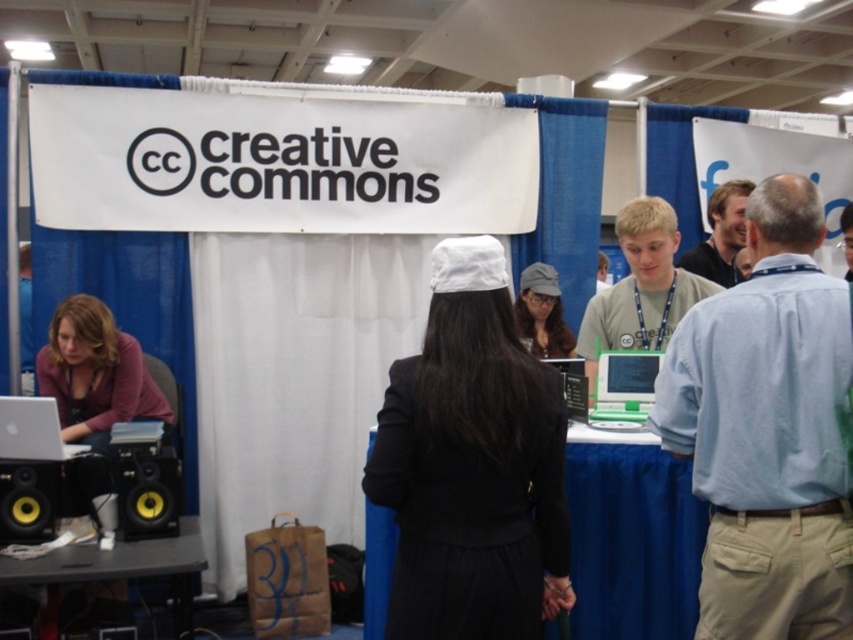
Based on the photo, does blue fabric table at center appear over matte green laptop at center?

Incorrect, blue fabric table at center is not positioned above matte green laptop at center.

Measure the distance between blue fabric table at center and camera.

Result: 7.63 feet

Measure the distance between blue fabric table at center and camera.

A distance of 7.63 feet exists between blue fabric table at center and camera.

The image size is (853, 640). Identify the location of blue fabric table at center. (631, 541).

Based on the photo, is white matte hat at center shorter than yellow/black speaker at lower left?

In fact, white matte hat at center may be taller than yellow/black speaker at lower left.

You are a GUI agent. You are given a task and a screenshot of the screen. Output one action in this format:
    pyautogui.click(x=<x>, y=<y>)
    Task: Click on the white matte hat at center
    This screenshot has width=853, height=640.
    Given the screenshot: What is the action you would take?
    pyautogui.click(x=473, y=465)

Where is `white matte hat at center`? The height and width of the screenshot is (640, 853). white matte hat at center is located at coordinates (473, 465).

Does matte purple sweater at left appear under light brown hair at upper right?

Indeed, matte purple sweater at left is positioned under light brown hair at upper right.

Is point (103, 342) in front of point (732, 260)?

Yes, it is in front of point (732, 260).

This screenshot has height=640, width=853. Identify the location of matte purple sweater at left. (96, 372).